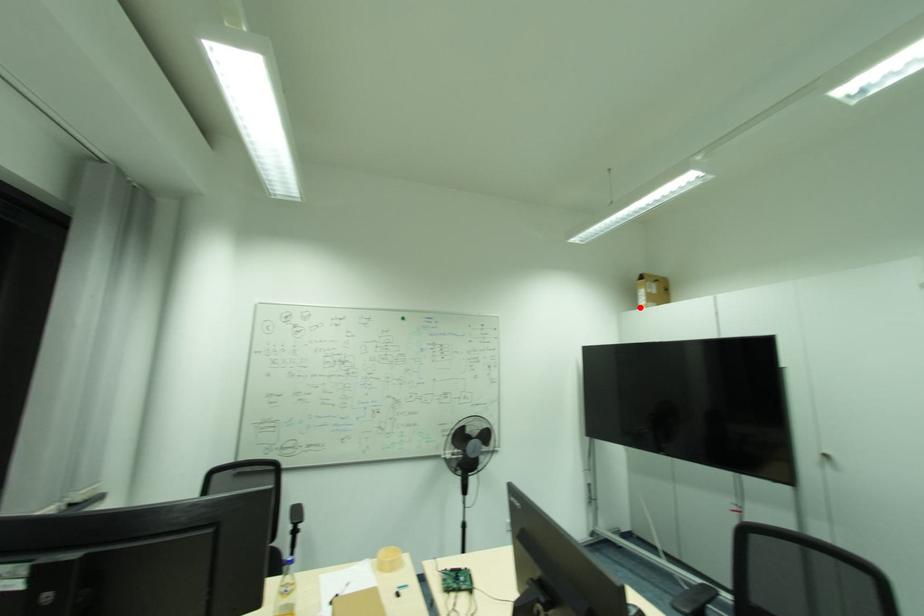
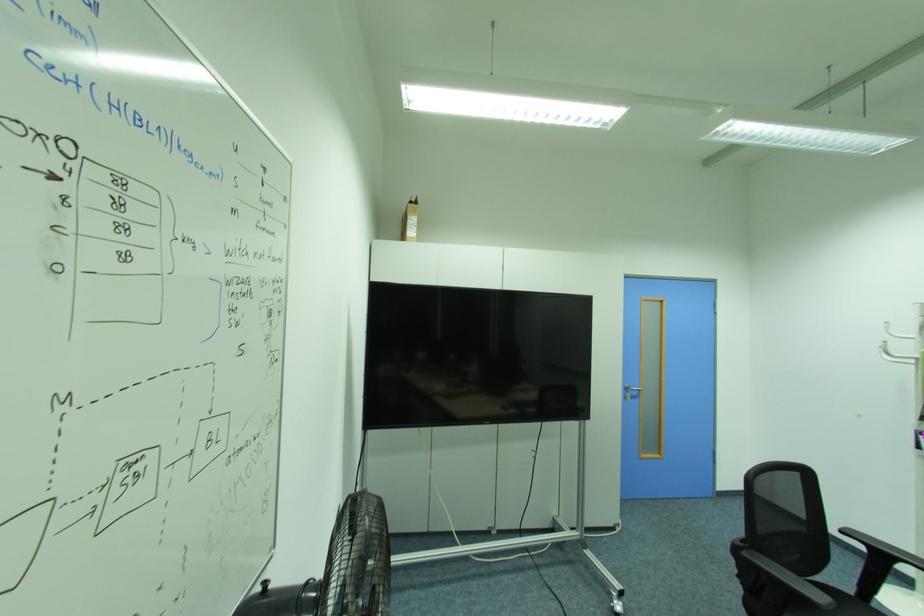
Question: I am providing you with two images of the same scene from different viewpoints. A red point is marked on the first image. Can you still see the location of the red point in image 2?

Choices:
 (A) Yes
 (B) No

Answer: (A)